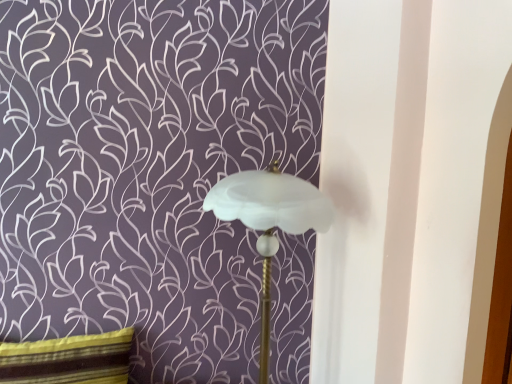
Question: Relative to white frosted glass lampshade at center, is striped fabric pillow at lower left in front or behind?

Choices:
 (A) front
 (B) behind

Answer: (B)

Question: From a real-world perspective, is striped fabric pillow at lower left positioned above or below white frosted glass lampshade at center?

Choices:
 (A) above
 (B) below

Answer: (B)

Question: Looking at their shapes, would you say striped fabric pillow at lower left is wider or thinner than white frosted glass lampshade at center?

Choices:
 (A) thin
 (B) wide

Answer: (A)

Question: Based on their sizes in the image, would you say white frosted glass lampshade at center is bigger or smaller than striped fabric pillow at lower left?

Choices:
 (A) small
 (B) big

Answer: (B)

Question: In the image, is white frosted glass lampshade at center positioned in front of or behind striped fabric pillow at lower left?

Choices:
 (A) behind
 (B) front

Answer: (B)

Question: From their relative heights in the image, would you say white frosted glass lampshade at center is taller or shorter than striped fabric pillow at lower left?

Choices:
 (A) tall
 (B) short

Answer: (A)

Question: Considering the positions of white frosted glass lampshade at center and striped fabric pillow at lower left in the image, is white frosted glass lampshade at center wider or thinner than striped fabric pillow at lower left?

Choices:
 (A) wide
 (B) thin

Answer: (A)